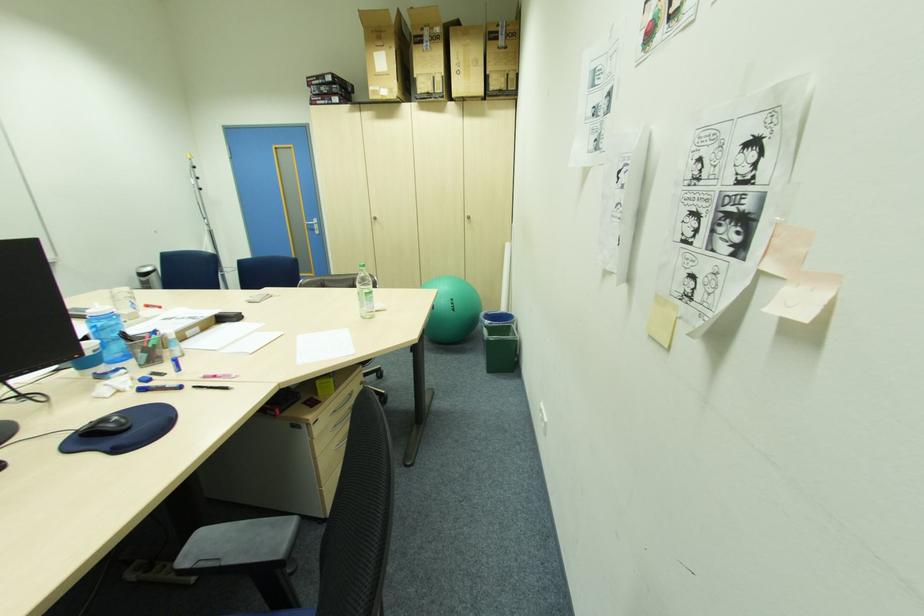
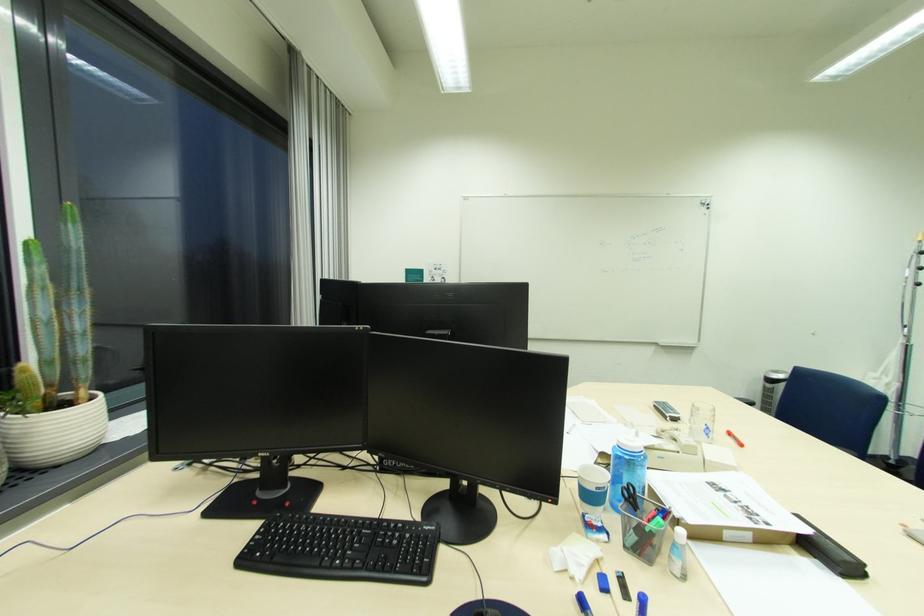
In the second image, find the point that corresponds to [150,268] in the first image.

(782, 373)